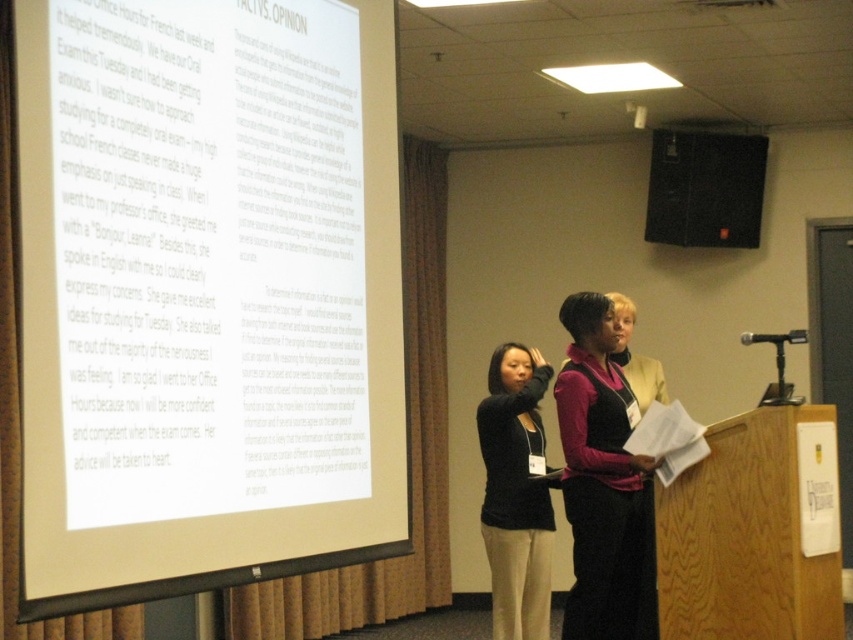
Question: Is white matte projector screen at upper left thinner than black matte speaker at upper right?

Choices:
 (A) no
 (B) yes

Answer: (A)

Question: Can you confirm if matte black dress at center is positioned below black matte speaker at upper right?

Choices:
 (A) yes
 (B) no

Answer: (A)

Question: Which point is closer to the camera?

Choices:
 (A) (537, 596)
 (B) (688, 145)
 (C) (579, 496)
 (D) (196, 525)

Answer: (D)

Question: Which point is closer to the camera?

Choices:
 (A) matte black dress at center
 (B) white matte projector screen at upper left
 (C) black sweater at center
 (D) black matte speaker at upper right

Answer: (B)

Question: Among these objects, which one is farthest from the camera?

Choices:
 (A) matte black dress at center
 (B) white matte projector screen at upper left

Answer: (A)

Question: Does matte black dress at center lie in front of black matte speaker at upper right?

Choices:
 (A) yes
 (B) no

Answer: (A)